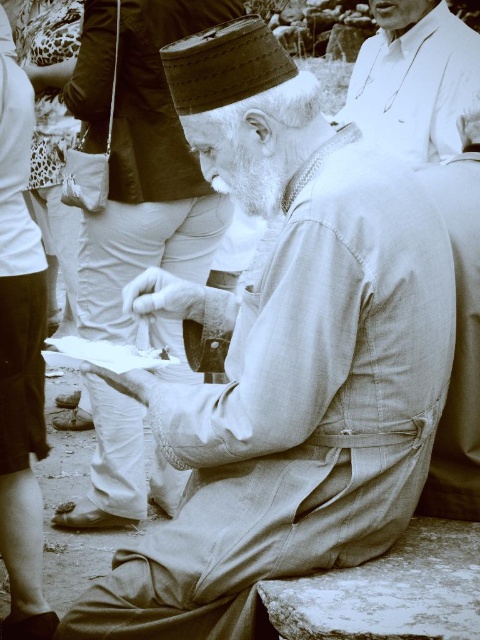
You are a photographer standing at the camera position in this vintage scene. You want to take a closeup shot of the elderly man but there is a white fabric shirt at upper right blocking your view. Can you move closer to the elderly man without moving the white fabric shirt? Explain how far you need to move to avoid the obstruction.

The white fabric shirt at upper right is 3.56 meters away from the camera. To avoid the obstruction, you need to move closer than 3.56 meters to the camera position so that the shirt is no longer in the frame between you and the elderly man.

You are an observer looking at the photograph. You notice the white fabric shirt at upper right and the light beige fabric at right. Which fabric is positioned higher in the image?

The white fabric shirt at upper right is positioned higher than the light beige fabric at right.

You are an observer in the scene and want to know which fabric is closer to you. Which one is closer between the white fabric shirt at upper right and the light beige fabric at right?

The white fabric shirt at upper right is closer to you because the light beige fabric at right is behind it.